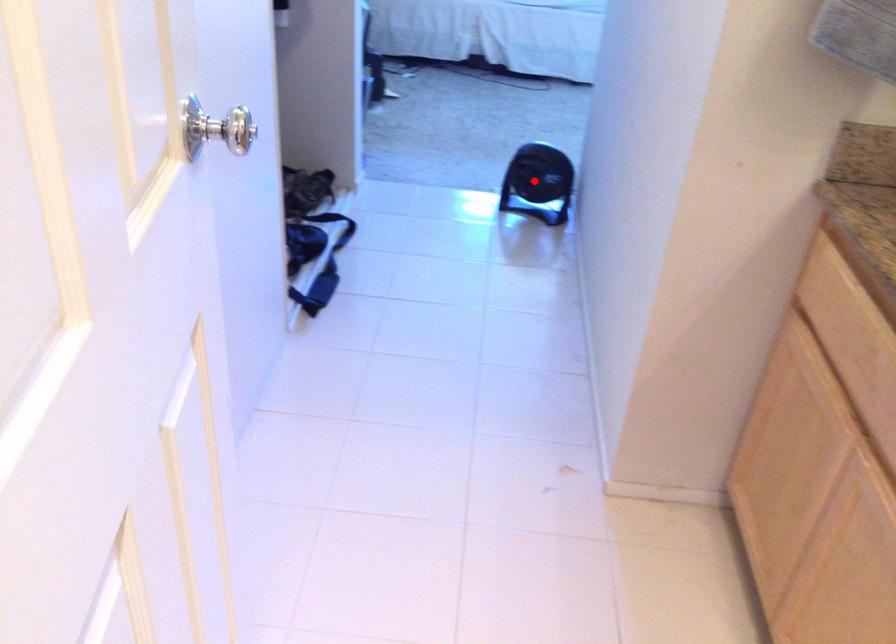
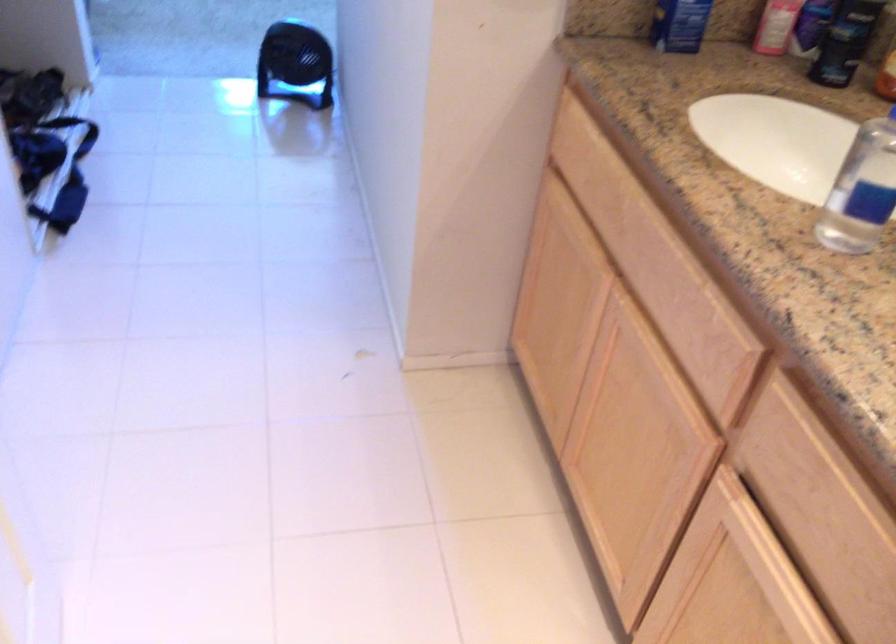
The point at the highlighted location is marked in the first image. Where is the corresponding point in the second image?

(295, 64)